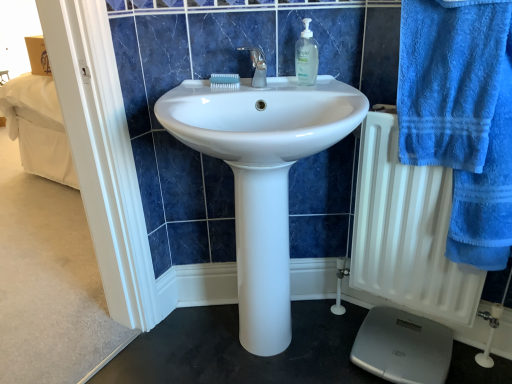
Where is `vacant space underneath blue terry cloth towel at right (from a real-world perspective)`? This screenshot has width=512, height=384. vacant space underneath blue terry cloth towel at right (from a real-world perspective) is located at coordinates (471, 362).